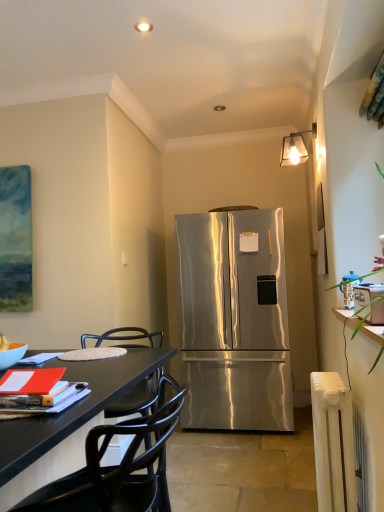
Question: Is matte orange book at lower left at the left side of stainless steel refrigerator at center?

Choices:
 (A) no
 (B) yes

Answer: (B)

Question: Is matte orange book at lower left facing towards stainless steel refrigerator at center?

Choices:
 (A) no
 (B) yes

Answer: (A)

Question: Does matte orange book at lower left appear on the right side of stainless steel refrigerator at center?

Choices:
 (A) no
 (B) yes

Answer: (A)

Question: From a real-world perspective, is matte orange book at lower left located beneath stainless steel refrigerator at center?

Choices:
 (A) no
 (B) yes

Answer: (A)

Question: Can you confirm if matte orange book at lower left is smaller than stainless steel refrigerator at center?

Choices:
 (A) no
 (B) yes

Answer: (B)

Question: Is black matte chair at lower left wider or thinner than stainless steel refrigerator at center?

Choices:
 (A) thin
 (B) wide

Answer: (A)

Question: Based on their positions, is black matte chair at lower left located to the left or right of stainless steel refrigerator at center?

Choices:
 (A) left
 (B) right

Answer: (A)

Question: From the image's perspective, is black matte chair at lower left located above or below stainless steel refrigerator at center?

Choices:
 (A) above
 (B) below

Answer: (B)

Question: Is black matte chair at lower left bigger or smaller than stainless steel refrigerator at center?

Choices:
 (A) big
 (B) small

Answer: (B)

Question: Considering the positions of clear glass lampshade at upper center and black matte chair at lower left in the image, is clear glass lampshade at upper center taller or shorter than black matte chair at lower left?

Choices:
 (A) tall
 (B) short

Answer: (B)

Question: From the image's perspective, is clear glass lampshade at upper center located above or below black matte chair at lower left?

Choices:
 (A) above
 (B) below

Answer: (A)

Question: Does point (314, 134) appear closer or farther from the camera than point (168, 428)?

Choices:
 (A) farther
 (B) closer

Answer: (A)

Question: In the image, is clear glass lampshade at upper center positioned in front of or behind black matte chair at lower left?

Choices:
 (A) behind
 (B) front

Answer: (A)

Question: Is stainless steel refrigerator at center to the left or to the right of clear glass lampshade at upper center in the image?

Choices:
 (A) right
 (B) left

Answer: (B)

Question: Is stainless steel refrigerator at center inside or outside of clear glass lampshade at upper center?

Choices:
 (A) inside
 (B) outside

Answer: (B)